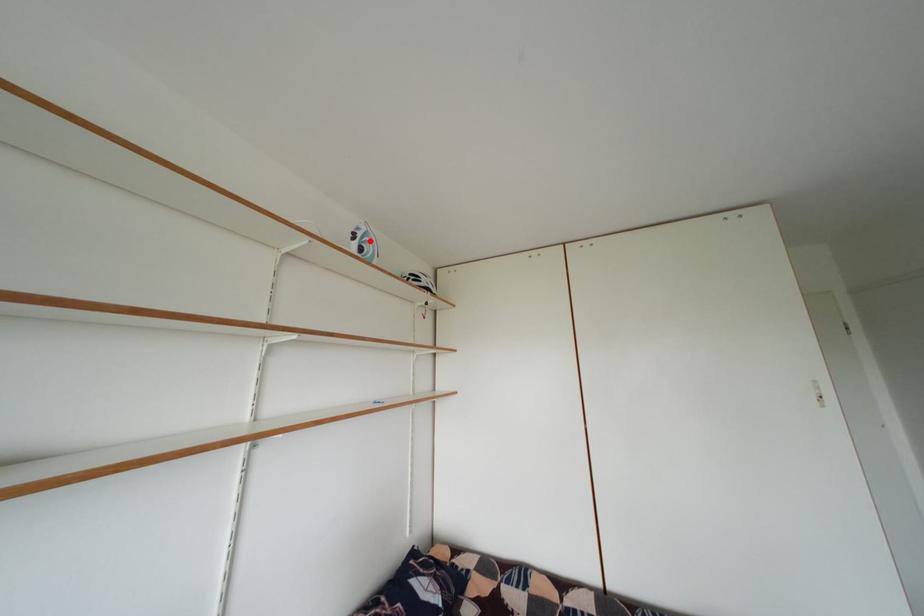
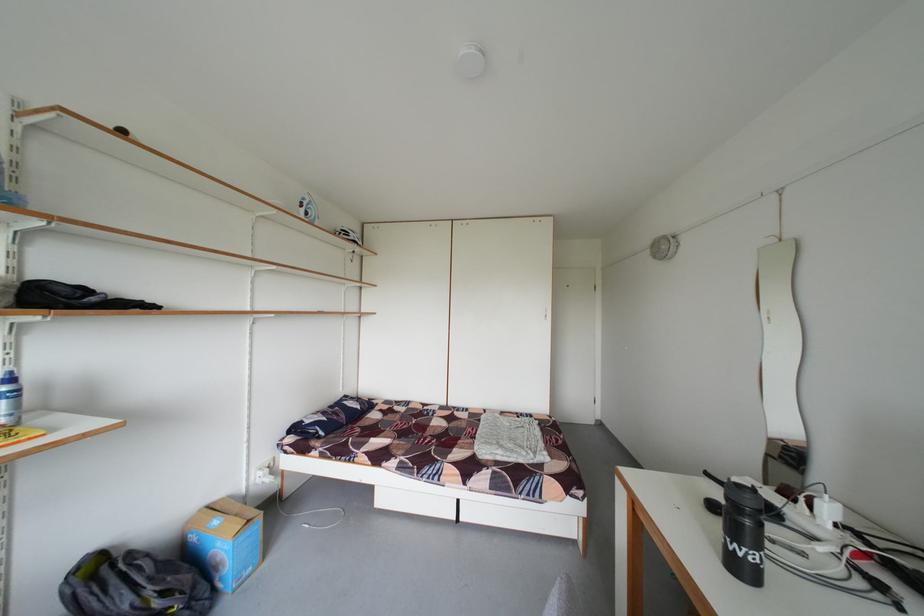
The point at the highlighted location is marked in the first image. Where is the corresponding point in the second image?

(315, 209)